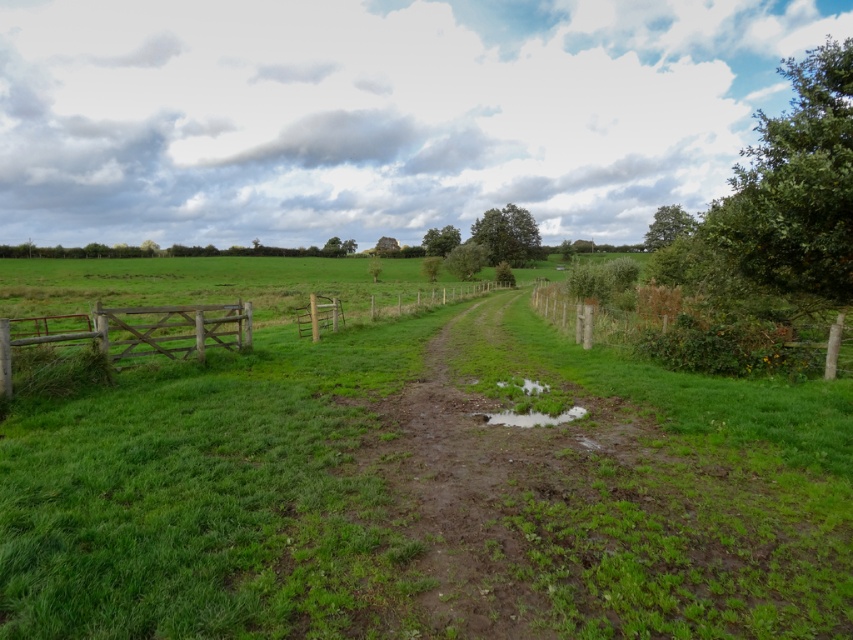
Can you confirm if green grassy at center is taller than wooden gate at left?

Indeed, green grassy at center has a greater height compared to wooden gate at left.

Image resolution: width=853 pixels, height=640 pixels. I want to click on green grassy at center, so click(410, 480).

Is point (584, 570) farther from camera compared to point (305, 316)?

No, (584, 570) is closer to viewer.

Between green grassy at center and wooden gate at center, which one appears on the left side from the viewer's perspective?

Positioned to the left is green grassy at center.

Between point (310, 525) and point (329, 330), which one is positioned behind?

The point (329, 330) is more distant.

Identify the location of green grassy at center. (410, 480).

Is point (172, 317) behind point (554, 420)?

Yes, point (172, 317) is farther from viewer.

Is wooden gate at left smaller than transparent water at center?

Incorrect, wooden gate at left is not smaller in size than transparent water at center.

Which is behind, point (196, 342) or point (552, 420)?

Positioned behind is point (196, 342).

I want to click on wooden gate at left, so click(x=132, y=332).